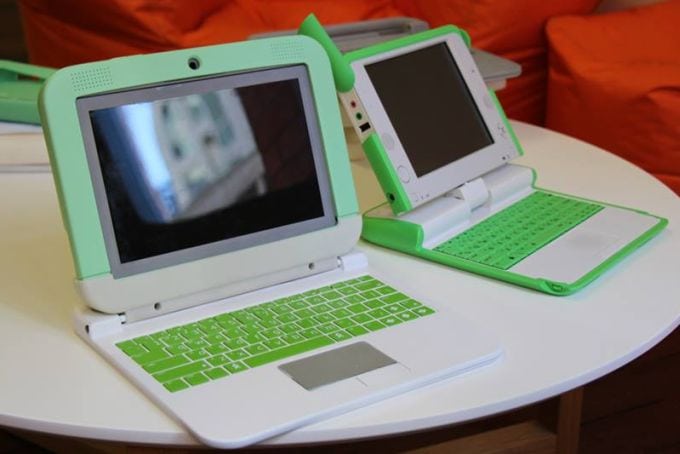
Where is `grey handle to pick up box`? grey handle to pick up box is located at coordinates (396, 144), (354, 29).